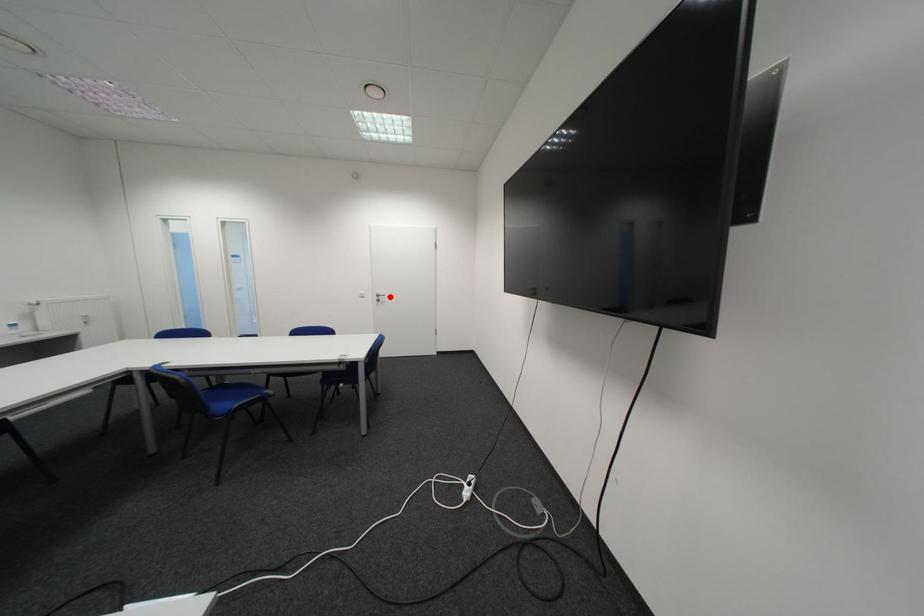
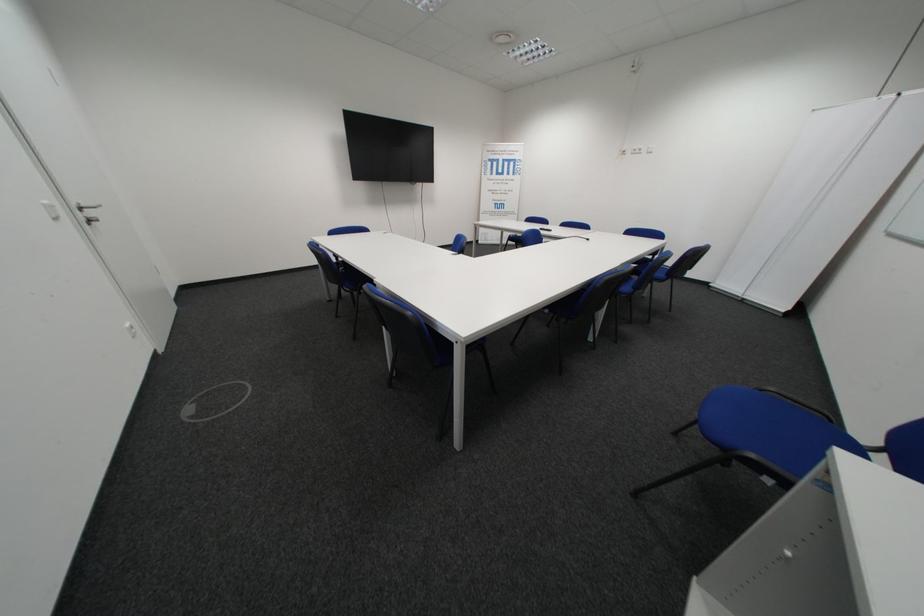
In the second image, find the point that corresponds to the highlighted location in the first image.

(93, 209)